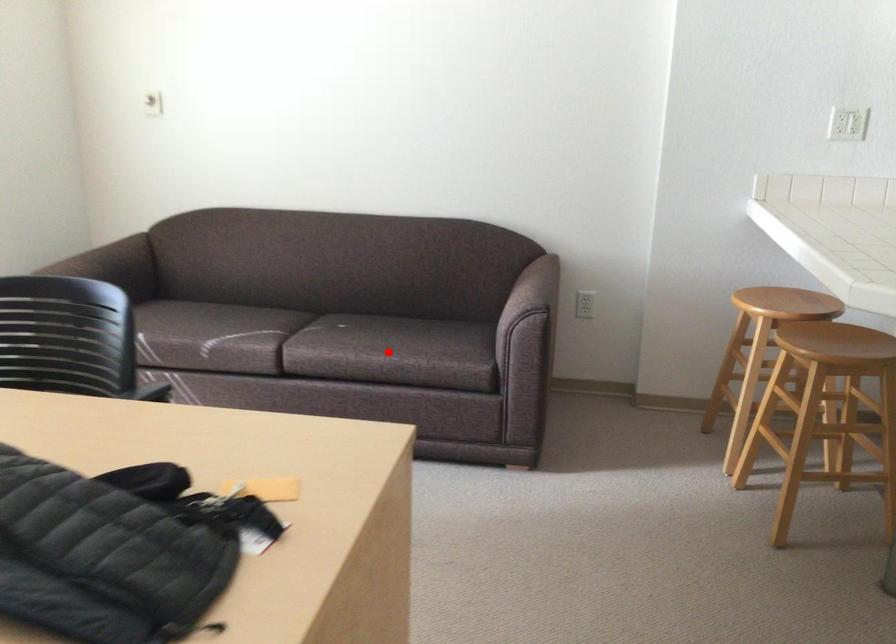
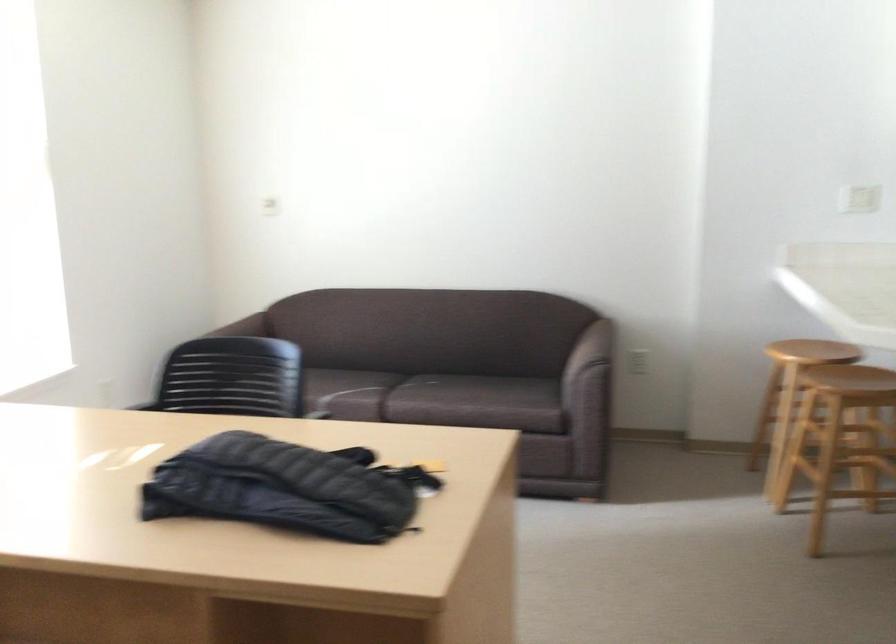
Question: I am providing you with two images of the same scene from different viewpoints. A red point is shown in image1. For the corresponding object point in image2, is it positioned nearer or farther from the camera?

Choices:
 (A) Nearer
 (B) Farther

Answer: (B)